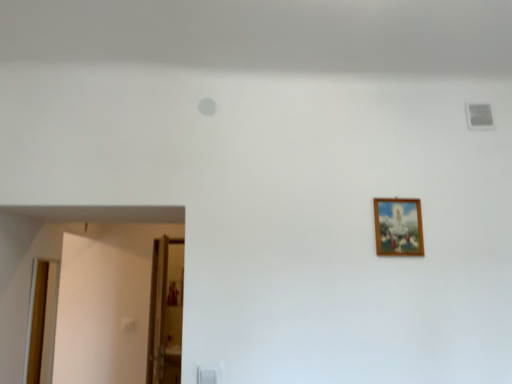
Question: From a real-world perspective, is wooden door at lower left, the first door viewed from the right, over wooden frame at upper right?

Choices:
 (A) no
 (B) yes

Answer: (A)

Question: From the image's perspective, is wooden door at lower left, the first door viewed from the right, below wooden frame at upper right?

Choices:
 (A) no
 (B) yes

Answer: (B)

Question: Is wooden door at lower left, the first door viewed from the right, facing towards wooden frame at upper right?

Choices:
 (A) no
 (B) yes

Answer: (A)

Question: Is wooden frame at upper right completely or partially inside wooden door at lower left, the first door viewed from the right?

Choices:
 (A) no
 (B) yes

Answer: (A)

Question: Is wooden door at lower left, the first door viewed from the right, oriented away from wooden frame at upper right?

Choices:
 (A) yes
 (B) no

Answer: (B)

Question: Is transparent glass door at lower left beside wooden door at left, the 1th door in the left-to-right sequence?

Choices:
 (A) yes
 (B) no

Answer: (B)

Question: Is transparent glass door at lower left wider than wooden door at left, which is the 2th door in right-to-left order?

Choices:
 (A) no
 (B) yes

Answer: (B)

Question: Is the position of transparent glass door at lower left less distant than that of wooden door at left, the 1th door in the left-to-right sequence?

Choices:
 (A) yes
 (B) no

Answer: (B)

Question: Is transparent glass door at lower left to the right of wooden door at left, which is the 2th door in right-to-left order, from the viewer's perspective?

Choices:
 (A) yes
 (B) no

Answer: (A)

Question: Is transparent glass door at lower left aimed at wooden door at left, the 1th door in the left-to-right sequence?

Choices:
 (A) yes
 (B) no

Answer: (B)

Question: Can you confirm if transparent glass door at lower left is smaller than wooden door at left, which is the 2th door in right-to-left order?

Choices:
 (A) yes
 (B) no

Answer: (B)

Question: Is wooden door at lower left, the second door when ordered from left to right, oriented away from wooden door at left, which is the 2th door in right-to-left order?

Choices:
 (A) yes
 (B) no

Answer: (B)